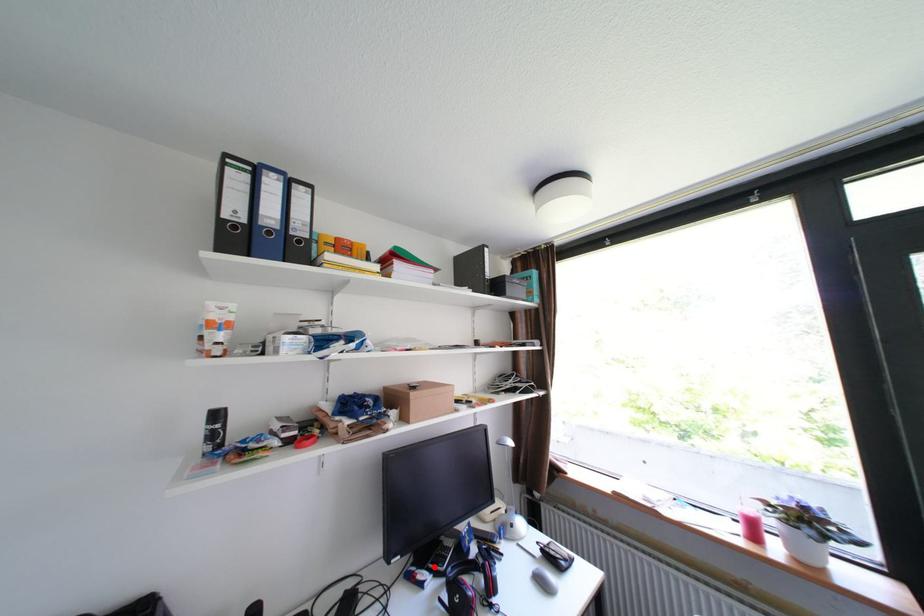
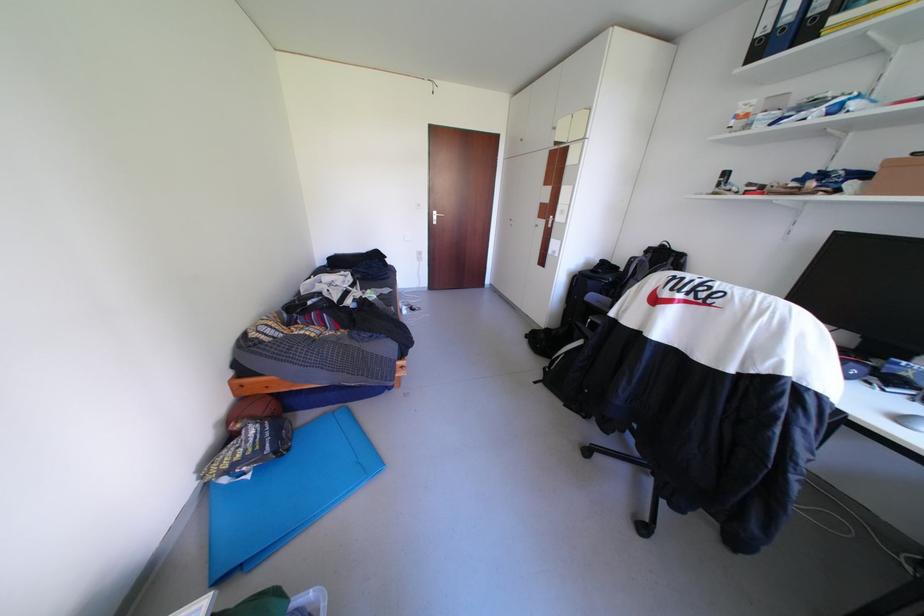
Question: I am providing you with two images of the same scene from different viewpoints. A red point is marked on the first image. Is the red point's position out of view in image 2?

Choices:
 (A) Yes
 (B) No

Answer: (A)